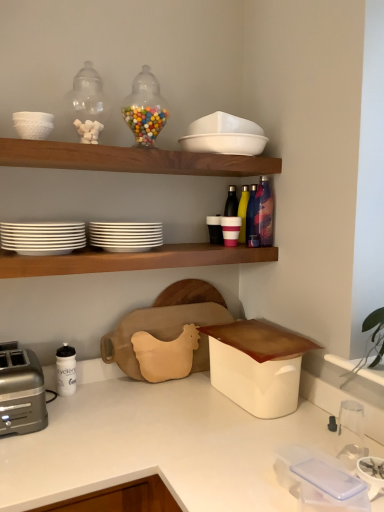
Locate an element on the screen. vacant space situated on the left part of matte black cup at center, the third tableware positioned from the top is located at coordinates (186, 241).